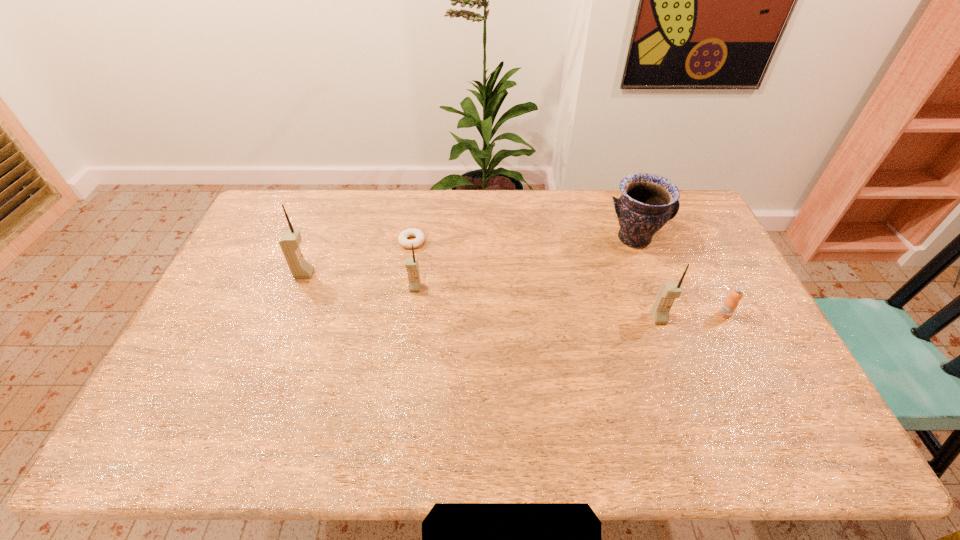
Image resolution: width=960 pixels, height=540 pixels. I want to click on free space between the leftmost cellular telephone and the second cellular telephone from left to right, so click(x=360, y=281).

This screenshot has width=960, height=540. What are the coordinates of `free space between the farthest cellular telephone and the doughnut` in the screenshot? It's located at (358, 258).

Where is `object that is the closest to the rightmost cellular telephone`? The image size is (960, 540). object that is the closest to the rightmost cellular telephone is located at coordinates click(730, 304).

Locate an element on the screen. object that is the third closest one to the second cellular telephone from right to left is located at coordinates (648, 201).

In order to click on cellular telephone that is the second closest to the farthest cellular telephone in this screenshot , I will do `click(668, 291)`.

The height and width of the screenshot is (540, 960). In order to click on cellular telephone that stands as the third closest to the shortest object in this screenshot , I will do `click(668, 291)`.

Identify the location of vacant space that satisfies the following two spatial constraints: 1. on the front side of the doughnut; 2. on the front of the leftmost object, where the keypad is located. The height and width of the screenshot is (540, 960). (407, 274).